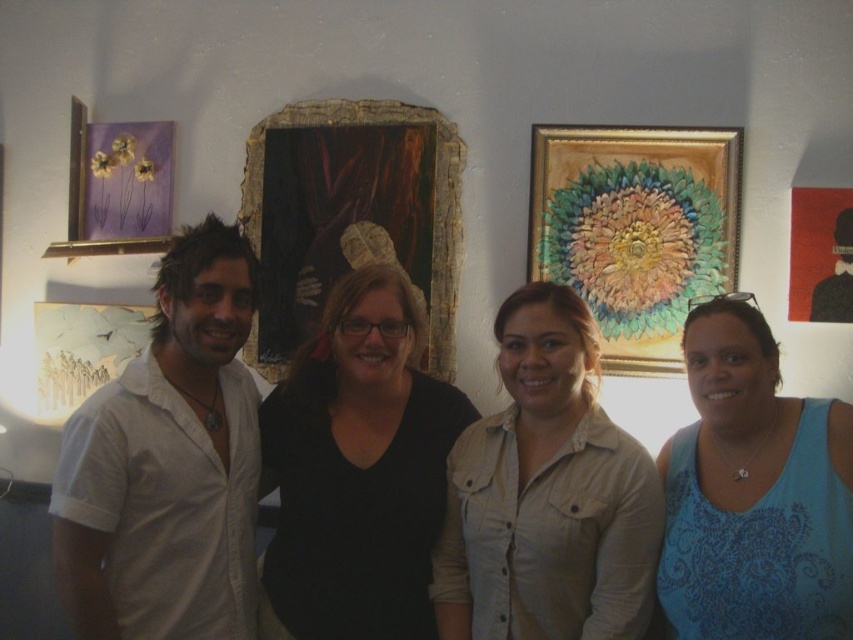
You are an art curator who needs to adjust the spacing between the black matte shirt at center and the gold textured painting at upper center to ensure proper lighting for both. The current distance between them is 1.25 meters. If the recommended minimum distance for optimal lighting is 1.5 meters, is the current spacing sufficient?

The current spacing between the black matte shirt at center and the gold textured painting at upper center is 1.25 meters, which is less than the recommended 1.5 meters. Therefore, the current spacing is insufficient for optimal lighting.